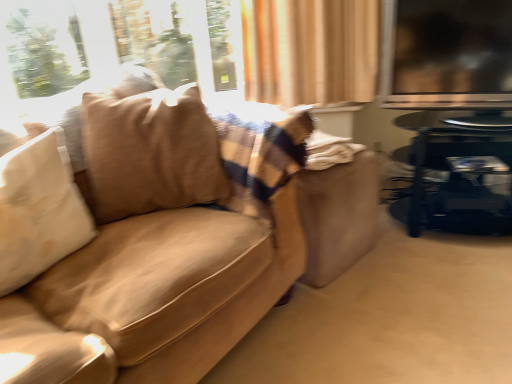
This screenshot has width=512, height=384. In order to click on transparent glass window screen at upper right in this screenshot , I will do `click(447, 54)`.

The image size is (512, 384). Describe the element at coordinates (458, 180) in the screenshot. I see `shiny black table at right` at that location.

Describe the element at coordinates (150, 152) in the screenshot. The width and height of the screenshot is (512, 384). I see `brown textured pillow at left` at that location.

You are a GUI agent. You are given a task and a screenshot of the screen. Output one action in this format:
    pyautogui.click(x=<x>, y=<y>)
    Task: Click on the transparent glass window screen at upper right
    
    Given the screenshot: What is the action you would take?
    pyautogui.click(x=447, y=54)

Which is in front, point (428, 82) or point (483, 172)?

The point (483, 172) is in front.

Does transparent glass window screen at upper right appear on the left side of shiny black table at right?

Yes, transparent glass window screen at upper right is to the left of shiny black table at right.

Is transparent glass window screen at upper right looking in the opposite direction of shiny black table at right?

transparent glass window screen at upper right is not turned away from shiny black table at right.

Identify the location of window screen on the left of shiny black table at right. (447, 54).

Which object is further away from the camera, white soft pillow at left or transparent glass window screen at upper right?

transparent glass window screen at upper right.

Is white soft pillow at left far from transparent glass window screen at upper right?

white soft pillow at left is far away from transparent glass window screen at upper right.

Is white soft pillow at left not inside transparent glass window screen at upper right?

white soft pillow at left is positioned outside transparent glass window screen at upper right.

Does transparent glass window screen at upper right have a greater height compared to white soft pillow at left?

Yes, transparent glass window screen at upper right is taller than white soft pillow at left.

Measure the distance between transparent glass window screen at upper right and white soft pillow at left.

transparent glass window screen at upper right is 4.82 feet away from white soft pillow at left.

Locate an element on the screen. The width and height of the screenshot is (512, 384). pillow below the transparent glass window screen at upper right (from a real-world perspective) is located at coordinates (39, 210).

Would you say transparent glass window screen at upper right is outside white soft pillow at left?

transparent glass window screen at upper right is positioned outside white soft pillow at left.

Is shiny black table at right bigger or smaller than suede-like beige couch at left?

shiny black table at right is smaller than suede-like beige couch at left.

From a real-world perspective, relative to suede-like beige couch at left, is shiny black table at right vertically above or below?

shiny black table at right is situated lower than suede-like beige couch at left in the real world.

Is shiny black table at right wider than suede-like beige couch at left?

No, shiny black table at right is not wider than suede-like beige couch at left.

Does brown textured pillow at left have a greater width compared to shiny black table at right?

No.

Measure the distance between brown textured pillow at left and shiny black table at right.

brown textured pillow at left is 3.83 feet from shiny black table at right.

From the image's perspective, which is below, brown textured pillow at left or shiny black table at right?

shiny black table at right appears lower in the image.

Consider the image. Could you tell me if brown textured pillow at left is turned towards shiny black table at right?

No, brown textured pillow at left is not aimed at shiny black table at right.

From a real-world perspective, which object stands above the other?

transparent glass window screen at upper right.

This screenshot has width=512, height=384. I want to click on window screen above the suede-like beige couch at left (from the image's perspective), so click(447, 54).

Does transparent glass window screen at upper right have a smaller size compared to suede-like beige couch at left?

Correct, transparent glass window screen at upper right occupies less space than suede-like beige couch at left.

How much distance is there between transparent glass window screen at upper right and suede-like beige couch at left?

They are 34.28 inches apart.

Is shiny black table at right far from transparent glass window screen at upper right?

shiny black table at right is actually quite close to transparent glass window screen at upper right.

Which of these two, shiny black table at right or transparent glass window screen at upper right, is thinner?

With smaller width is transparent glass window screen at upper right.

Can you tell me how much shiny black table at right and transparent glass window screen at upper right differ in facing direction?

There is a 1.93-degree angle between the facing directions of shiny black table at right and transparent glass window screen at upper right.

You are a GUI agent. You are given a task and a screenshot of the screen. Output one action in this format:
    pyautogui.click(x=<x>, y=<y>)
    Task: Click on the table below the transparent glass window screen at upper right (from a real-world perspective)
    Image resolution: width=512 pixels, height=384 pixels.
    Given the screenshot: What is the action you would take?
    pyautogui.click(x=458, y=180)

The width and height of the screenshot is (512, 384). What are the coordinates of `window screen lying on the left of shiny black table at right` in the screenshot? It's located at (447, 54).

Find the location of a particular element. window screen to the right of white soft pillow at left is located at coordinates (447, 54).

Which object lies nearer to the anchor point shiny black table at right, transparent glass window screen at upper right or brown textured pillow at left?

Based on the image, transparent glass window screen at upper right appears to be nearer to shiny black table at right.

Which object lies further to the anchor point white soft pillow at left, brown textured pillow at left or transparent glass window screen at upper right?

transparent glass window screen at upper right lies further to white soft pillow at left than the other object.

When comparing their distances from brown textured pillow at left, does transparent glass window screen at upper right or shiny black table at right seem closer?

transparent glass window screen at upper right.

Looking at the image, which one is located closer to brown textured pillow at left, shiny black table at right or white soft pillow at left?

white soft pillow at left is closer to brown textured pillow at left.

When comparing their distances from white soft pillow at left, does shiny black table at right or transparent glass window screen at upper right seem further?

Based on the image, shiny black table at right appears to be further to white soft pillow at left.

Based on their spatial positions, is suede-like beige couch at left or transparent glass window screen at upper right further from brown textured pillow at left?

transparent glass window screen at upper right.

Which object lies nearer to the anchor point shiny black table at right, transparent glass window screen at upper right or suede-like beige couch at left?

The object closer to shiny black table at right is transparent glass window screen at upper right.

From the picture: Which object lies nearer to the anchor point transparent glass window screen at upper right, shiny black table at right or white soft pillow at left?

Based on the image, shiny black table at right appears to be nearer to transparent glass window screen at upper right.

The image size is (512, 384). Find the location of `window screen located between white soft pillow at left and shiny black table at right in the left-right direction`. window screen located between white soft pillow at left and shiny black table at right in the left-right direction is located at coordinates (447, 54).

Identify the location of window screen located between suede-like beige couch at left and shiny black table at right in the left-right direction. The width and height of the screenshot is (512, 384). (447, 54).

Find the location of a particular element. studio couch situated between white soft pillow at left and shiny black table at right from left to right is located at coordinates (152, 238).

Find the location of a particular element. throw pillow between suede-like beige couch at left and transparent glass window screen at upper right from left to right is located at coordinates (150, 152).